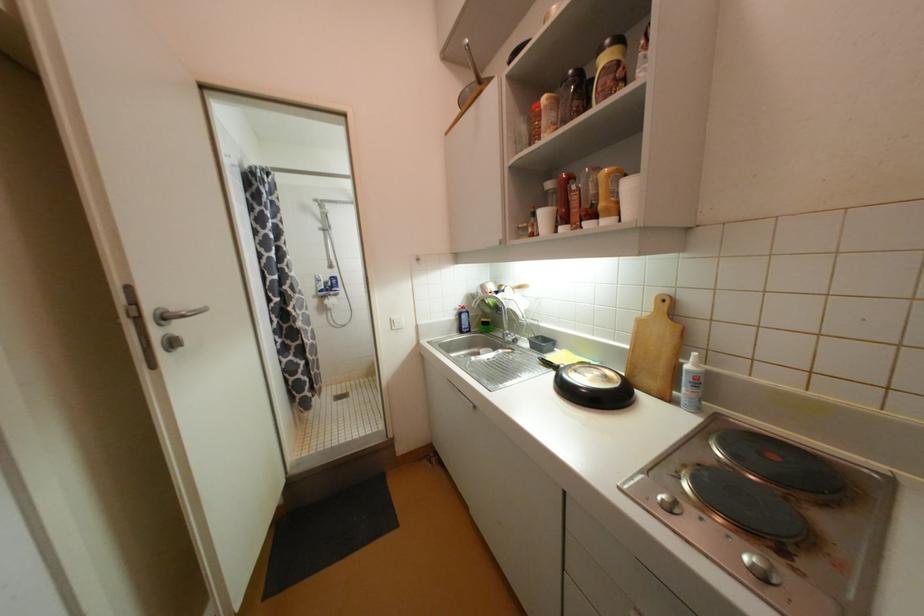
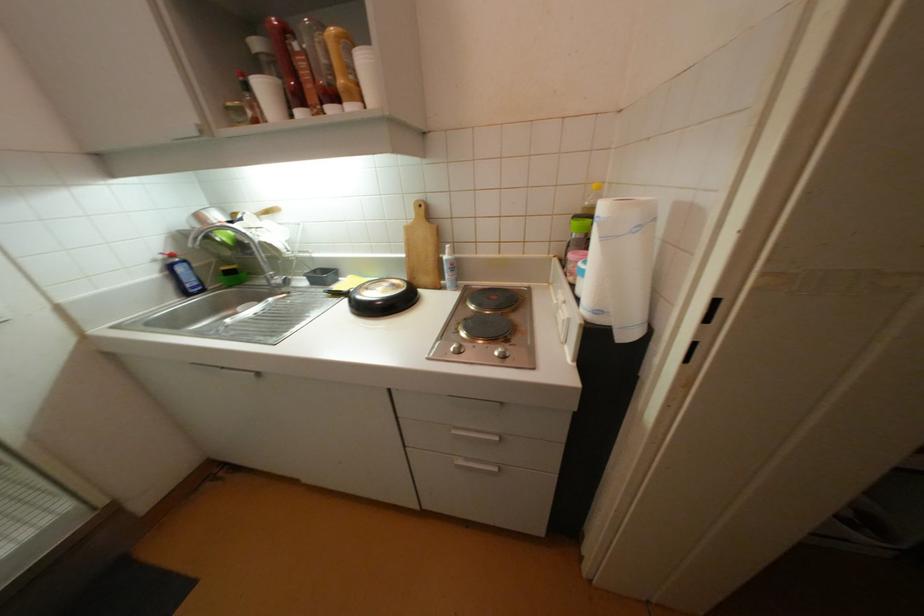
The first image is from the beginning of the video and the second image is from the end. How did the camera likely rotate when shooting the video?

The camera rotated toward right-down.